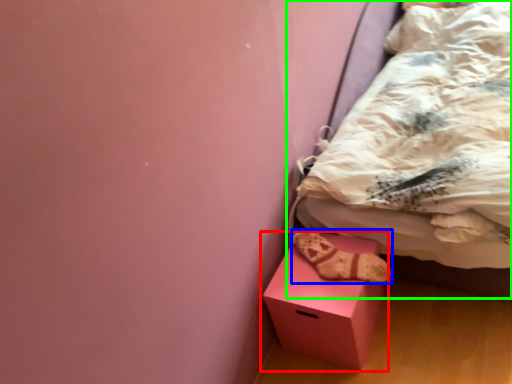
Question: Which object is the farthest from box (highlighted by a red box)? Choose among these: footwear (highlighted by a blue box) or bed (highlighted by a green box).

Choices:
 (A) footwear
 (B) bed

Answer: (B)